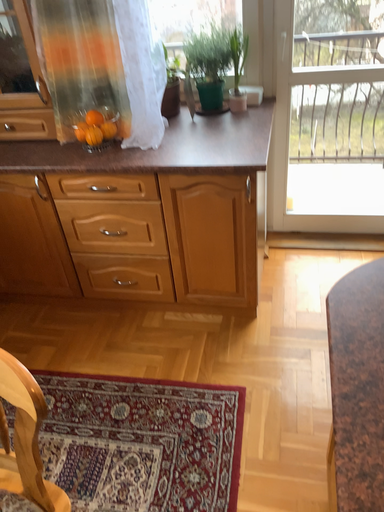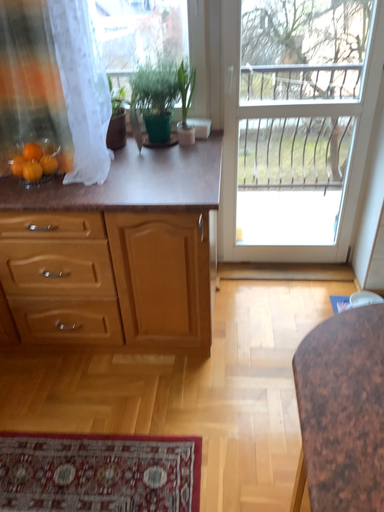
Question: How did the camera likely rotate when shooting the video?

Choices:
 (A) rotated right
 (B) rotated left

Answer: (A)